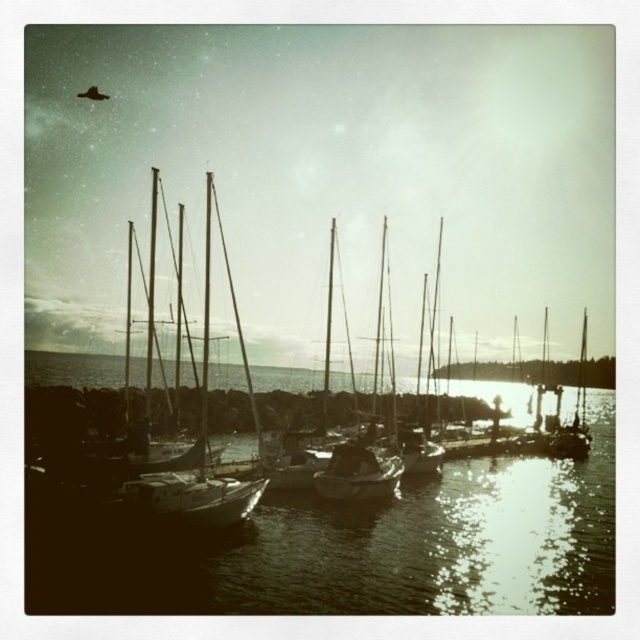
You are a GUI agent. You are given a task and a screenshot of the screen. Output one action in this format:
    pyautogui.click(x=<x>, y=<y>)
    Task: Click on the sepia reflective water at center
    
    Given the screenshot: What is the action you would take?
    pyautogui.click(x=412, y=545)

Is point (557, 612) positioned before point (368, 456)?

Yes.

Image resolution: width=640 pixels, height=640 pixels. In order to click on sepia reflective water at center in this screenshot , I will do `click(412, 545)`.